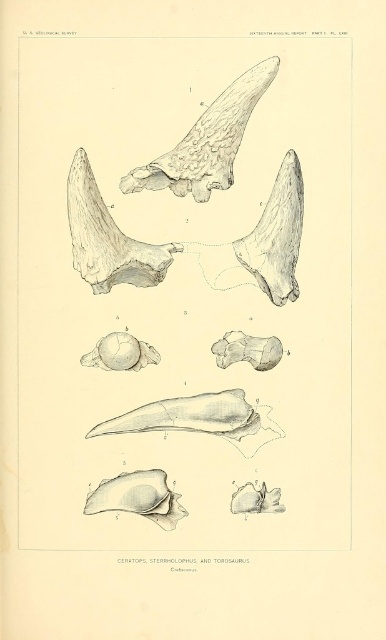
Is gray textured bone at center shorter than smooth gray skull at lower right?

In fact, gray textured bone at center may be taller than smooth gray skull at lower right.

Is point (140, 509) positioned after point (230, 502)?

That is False.

This screenshot has height=640, width=386. What are the coordinates of `gray textured bone at center` in the screenshot? It's located at (189, 243).

Can you confirm if smooth gray bone at lower left is thinner than smooth gray skull at lower right?

No, smooth gray bone at lower left is not thinner than smooth gray skull at lower right.

Is point (160, 497) positioned after point (235, 504)?

No, (160, 497) is closer to viewer.

In the scene shown: Who is more distant from viewer, (138, 504) or (259, 486)?

The point (259, 486) is more distant.

This screenshot has height=640, width=386. I want to click on smooth gray bone at lower left, so click(138, 497).

Does matte gray skull at center-left have a greater width compared to smooth gray skull at lower right?

Correct, the width of matte gray skull at center-left exceeds that of smooth gray skull at lower right.

Between matte gray skull at center-left and smooth gray skull at lower right, which one appears on the right side from the viewer's perspective?

smooth gray skull at lower right is more to the right.

Is point (155, 353) farther from viewer compared to point (231, 497)?

Yes, point (155, 353) is behind point (231, 497).

Find the location of a particular element. The image size is (386, 640). matte gray skull at center-left is located at coordinates (120, 353).